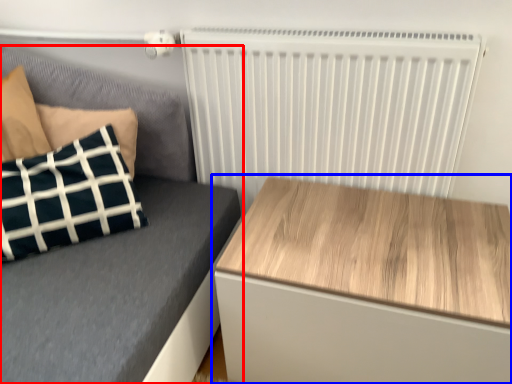
Question: Which object is closer to the camera taking this photo, furniture (highlighted by a red box) or table (highlighted by a blue box)?

Choices:
 (A) furniture
 (B) table

Answer: (B)